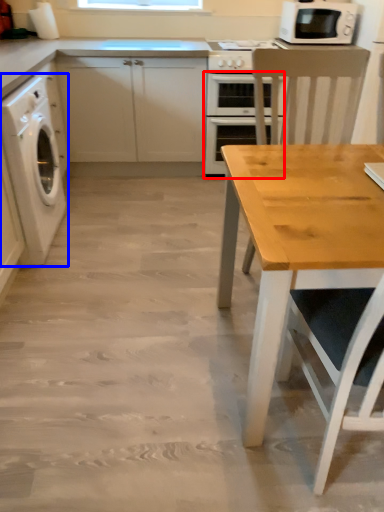
Question: Which of the following is the farthest to the observer, oven (highlighted by a red box) or washing machine (highlighted by a blue box)?

Choices:
 (A) oven
 (B) washing machine

Answer: (A)